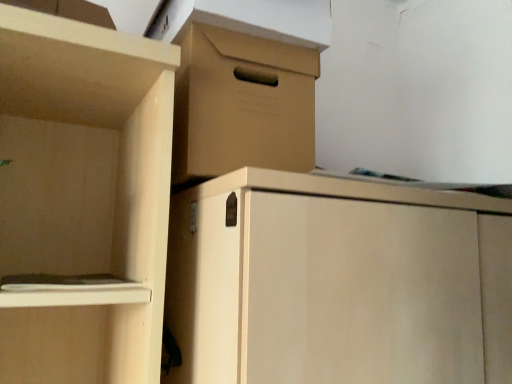
You are a GUI agent. You are given a task and a screenshot of the screen. Output one action in this format:
    pyautogui.click(x=<x>, y=<y>)
    Task: Click on the matte cardboard box at upper center
    
    Given the screenshot: What is the action you would take?
    pyautogui.click(x=242, y=104)

What do you see at coordinates (242, 104) in the screenshot?
I see `matte cardboard box at upper center` at bounding box center [242, 104].

Image resolution: width=512 pixels, height=384 pixels. I want to click on matte cardboard box at upper center, so click(x=242, y=104).